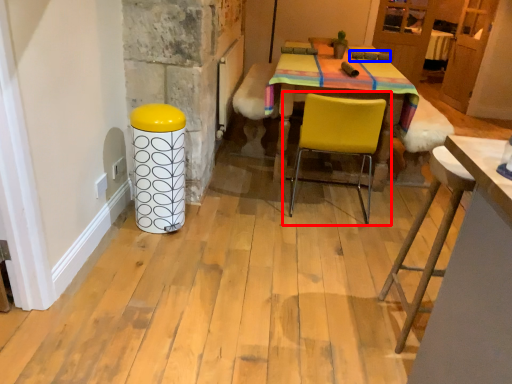
Question: Which of the following is the farthest to the observer, chair (highlighted by a red box) or armchair (highlighted by a blue box)?

Choices:
 (A) chair
 (B) armchair

Answer: (B)